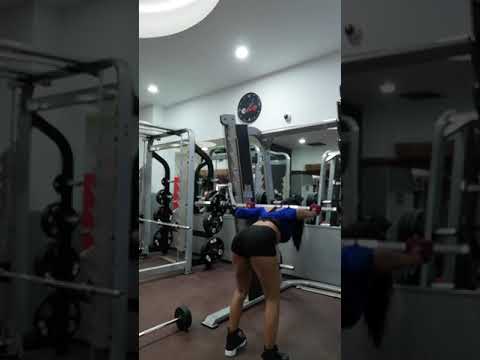
Where is `lights`? The width and height of the screenshot is (480, 360). lights is located at coordinates (155, 85), (240, 52), (387, 84).